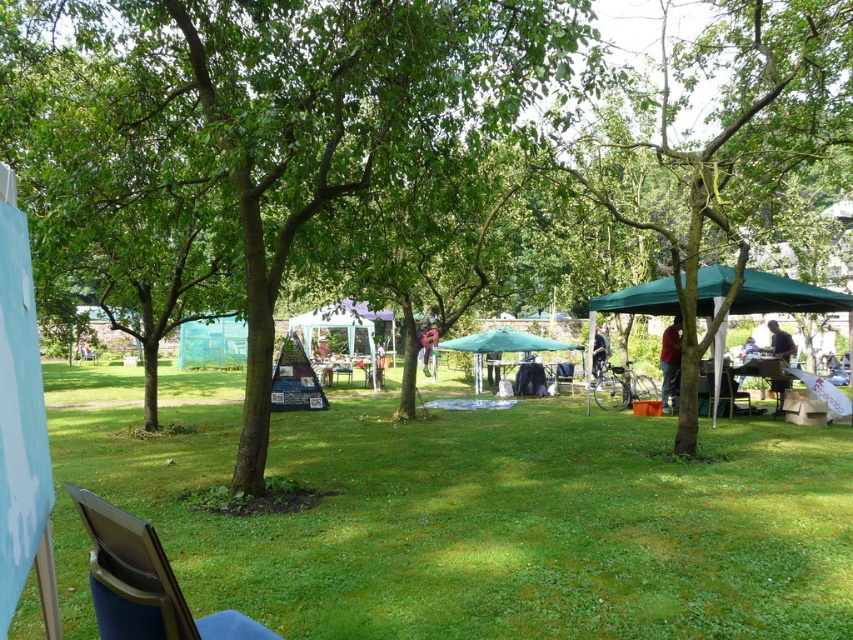
You are a person who is 1.7 meters tall and standing at the wooden chair at center. You want to reach the dark brown leather jacket at center without moving your feet. Can you do it?

The distance between the wooden chair at center and the dark brown leather jacket at center is 1.07 meters. Since you are 1.7 meters tall, your arms can reach approximately 0.5 meters in front of you. Therefore, you cannot reach the jacket without moving your feet.

You are planning to set up a picnic blanket under the green leafy tree at center and the blue fabric folding chair at lower left. Which object would provide more shade for your picnic?

The blue fabric folding chair at lower left is taller than the green leafy tree at center, so it would provide more shade for your picnic.